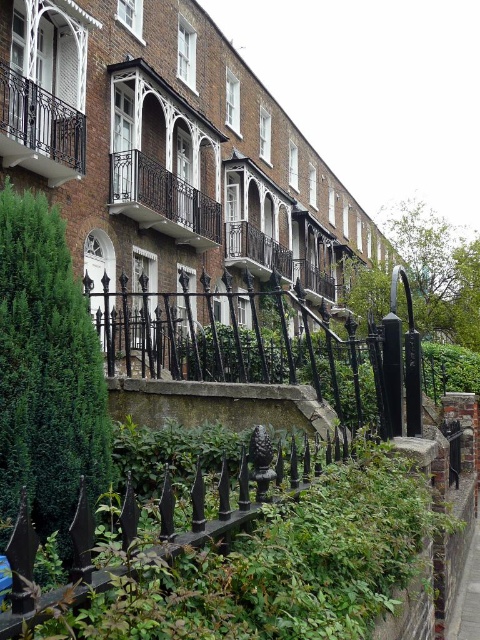
You are a gardener looking at the brick terraced houses. You need to trim the green leafy hedge at lower left and the dark brown wrought iron balcony at center. Which object is located lower in the image?

The green leafy hedge at lower left is located below the dark brown wrought iron balcony at center, so it is lower in the image.

You are standing in front of the row of brick terraced houses and see two points marked on the image. The first point is at coordinates point (12,403) and the second is at point (470,588). From your perspective, which point is closer to you?

Point (12,403) is in front of point (470,588), so it is closer to you.